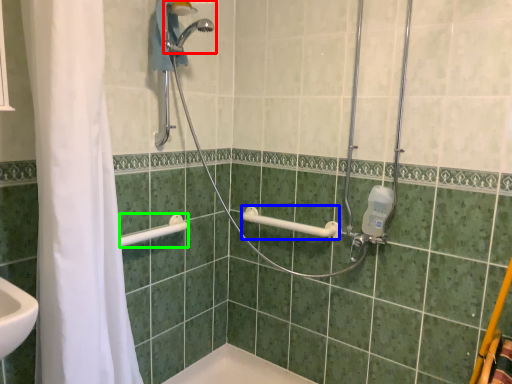
Question: Estimate the real-world distances between objects in this image. Which object is farther from shower (highlighted by a red box), towel bar (highlighted by a blue box) or shower (highlighted by a green box)?

Choices:
 (A) towel bar
 (B) shower

Answer: (A)